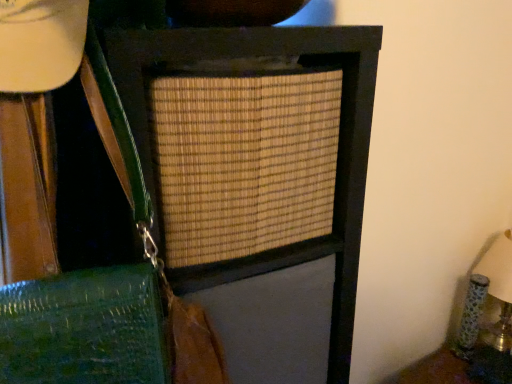
Where is `woven wood frame at center`? The height and width of the screenshot is (384, 512). woven wood frame at center is located at coordinates (193, 209).

What is the approximate width of woven wood frame at center?

It is 29.24 centimeters.

The height and width of the screenshot is (384, 512). Describe the element at coordinates (193, 209) in the screenshot. I see `woven wood frame at center` at that location.

I want to click on woven wood frame at center, so click(x=193, y=209).